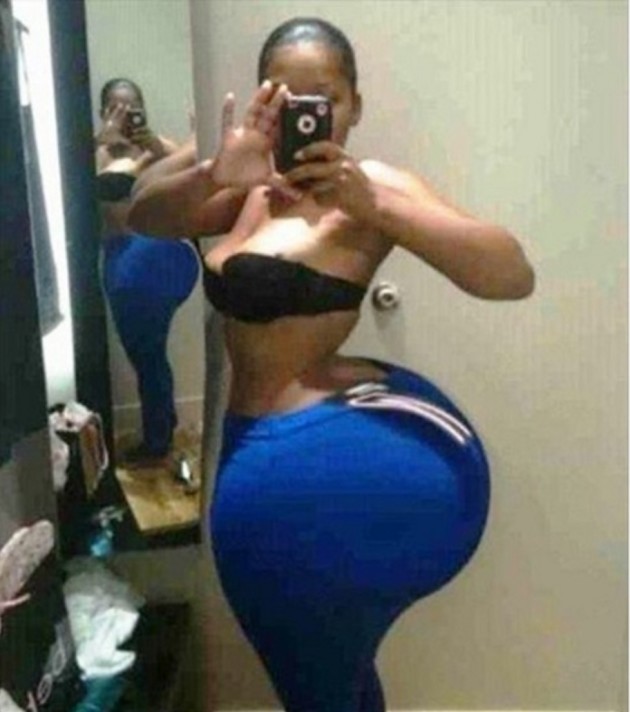
I want to click on door stop, so click(x=396, y=303).